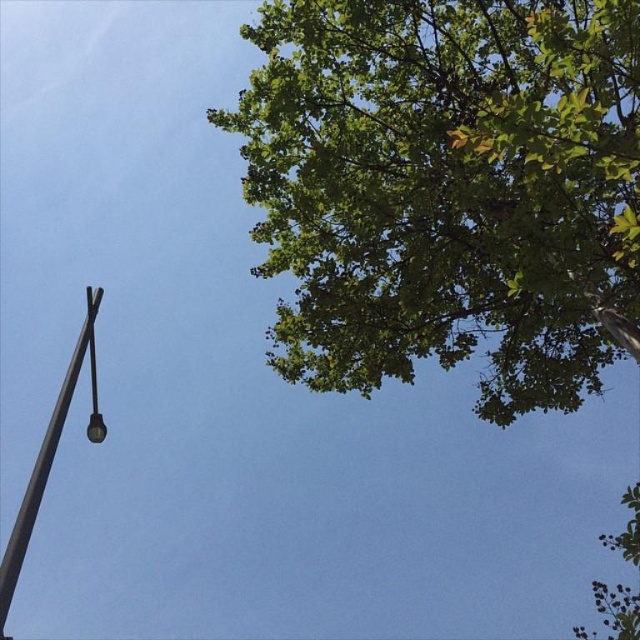
Question: Is green leafy tree at upper right to the right of polished metal pole at left from the viewer's perspective?

Choices:
 (A) no
 (B) yes

Answer: (B)

Question: Which point is farther from the camera taking this photo?

Choices:
 (A) (317, 148)
 (B) (38, 484)

Answer: (A)

Question: Among these points, which one is nearest to the camera?

Choices:
 (A) (636, 616)
 (B) (29, 504)

Answer: (B)

Question: Can you confirm if green leafy tree at upper right is positioned above polished metal pole at left?

Choices:
 (A) yes
 (B) no

Answer: (A)

Question: Is green leafy tree at upper right smaller than polished metal pole at left?

Choices:
 (A) yes
 (B) no

Answer: (B)